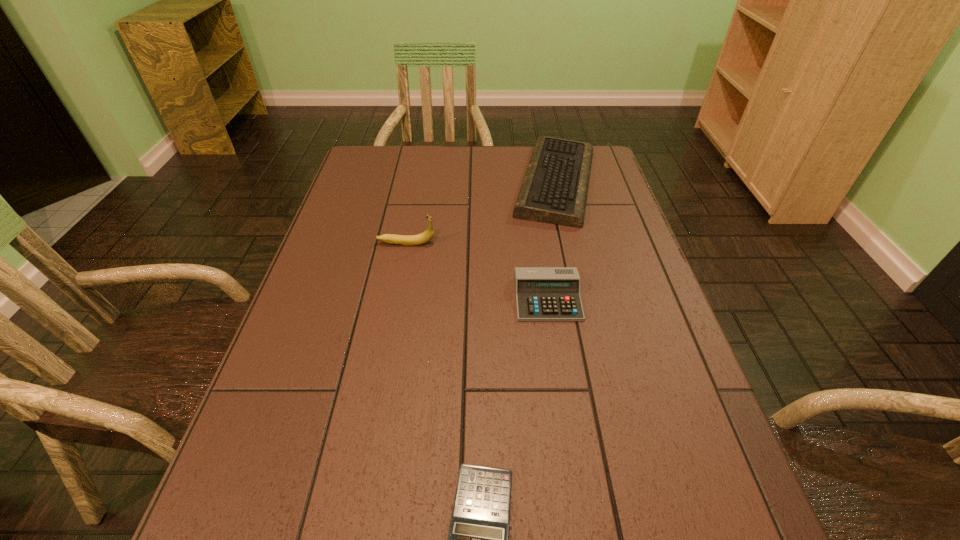
You are a GUI agent. You are given a task and a screenshot of the screen. Output one action in this format:
    pyautogui.click(x=<x>, y=<y>)
    Task: Click on the object that is at the right edge
    
    Given the screenshot: What is the action you would take?
    pyautogui.click(x=554, y=190)

Where is `object situated at the far right corner`? This screenshot has height=540, width=960. object situated at the far right corner is located at coordinates (554, 190).

Image resolution: width=960 pixels, height=540 pixels. I want to click on vacant area at the far edge of the desktop, so click(484, 167).

This screenshot has width=960, height=540. What are the coordinates of `vacant space at the left edge of the desktop` in the screenshot? It's located at (331, 293).

The image size is (960, 540). Find the location of `free space at the right edge`. free space at the right edge is located at coordinates (598, 305).

Identify the location of vacant space at the far left corner of the desktop. (380, 148).

You are a GUI agent. You are given a task and a screenshot of the screen. Output one action in this format:
    pyautogui.click(x=<x>, y=<y>)
    Task: Click on the free space at the far right corner of the desktop
    
    Given the screenshot: What is the action you would take?
    pyautogui.click(x=609, y=171)

The width and height of the screenshot is (960, 540). I want to click on vacant area that lies between the farthest object and the leftmost object, so click(x=481, y=213).

Where is `free space between the right calculator and the tallest object`? The width and height of the screenshot is (960, 540). free space between the right calculator and the tallest object is located at coordinates (477, 271).

Select which object appears as the third closest to the nearer calculator. Please provide its 2D coordinates. Your answer should be formatted as a tuple, i.e. [(x, y)], where the tuple contains the x and y coordinates of a point satisfying the conditions above.

[(554, 190)]